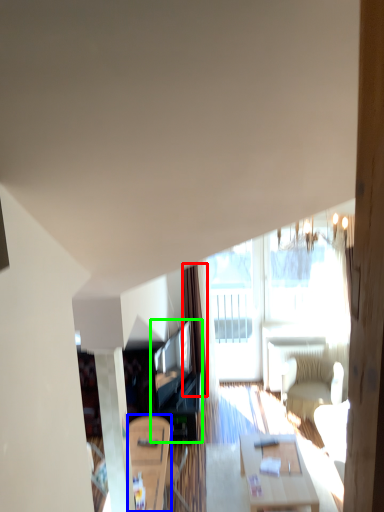
Question: Considering the real-world distances, which object is closest to curtain (highlighted by a red box)? table (highlighted by a blue box) or entertainment center (highlighted by a green box).

Choices:
 (A) table
 (B) entertainment center

Answer: (B)